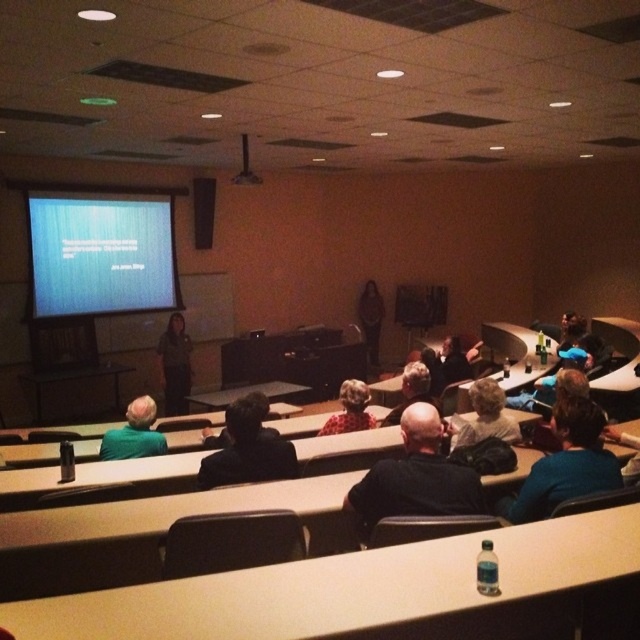
Is matte blue screen at upper left to the right of light brown hair at center from the viewer's perspective?

No, matte blue screen at upper left is not to the right of light brown hair at center.

Which is in front, point (131, 260) or point (451, 429)?

Point (451, 429) is in front.

Where is `matte blue screen at upper left`? matte blue screen at upper left is located at coordinates (100, 253).

Can you confirm if blue shirt at center is positioned below dark brown leather jacket at center?

Correct, blue shirt at center is located below dark brown leather jacket at center.

Between blue shirt at center and dark brown leather jacket at center, which one is positioned lower?

blue shirt at center

Locate an element on the screen. blue shirt at center is located at coordinates (564, 465).

This screenshot has height=640, width=640. Identify the location of blue shirt at center. (564, 465).

Where is `matte blue screen at upper left`? matte blue screen at upper left is located at coordinates (100, 253).

Where is `matte blue screen at upper left`? The image size is (640, 640). matte blue screen at upper left is located at coordinates (100, 253).